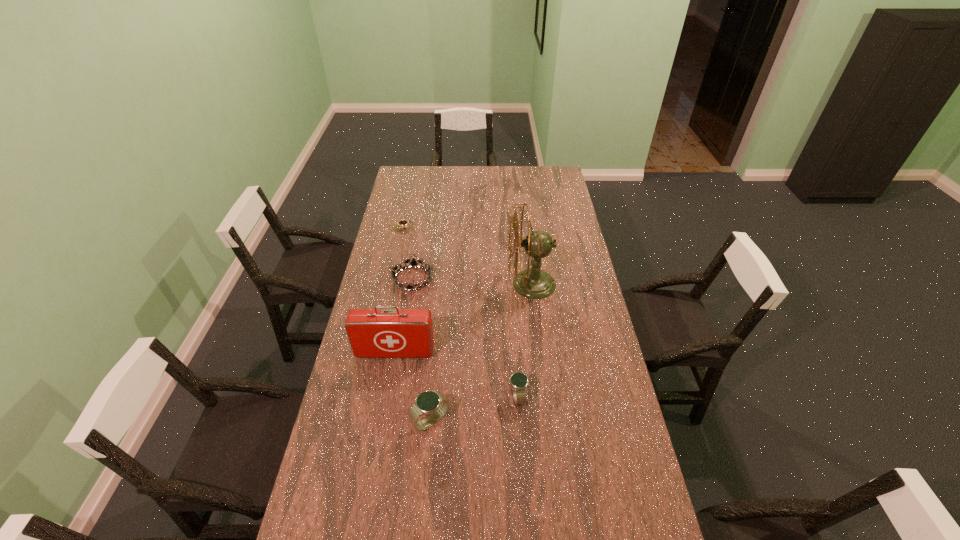
This screenshot has width=960, height=540. In order to click on vacant region located 0.150m on the back of the second watch from left to right in this screenshot , I will do `click(436, 368)`.

The image size is (960, 540). Identify the location of free spot located 0.340m on the back of the rightmost watch. tap(512, 309).

Identify the location of blank space located 0.200m on the front of the farthest watch. This screenshot has width=960, height=540. (397, 258).

The height and width of the screenshot is (540, 960). Find the location of `vacant space located on the side of the third nearest object with the first aid cross symbol`. vacant space located on the side of the third nearest object with the first aid cross symbol is located at coordinates (391, 376).

Image resolution: width=960 pixels, height=540 pixels. I want to click on free spot located 0.380m in front of the fan, directing air flow, so click(417, 284).

Find the location of a particular element. The height and width of the screenshot is (540, 960). vacant point located 0.380m in front of the fan, directing air flow is located at coordinates (417, 284).

Locate an element on the screen. The image size is (960, 540). free space located in front of the fan, directing air flow is located at coordinates (495, 284).

The width and height of the screenshot is (960, 540). What are the coordinates of `free location located 0.320m on the front-facing side of the fifth tallest object` in the screenshot? It's located at (510, 279).

Identify the location of watch that is at the left edge. (402, 222).

Find the location of a particular element. the first-aid kit that is positioned at the left edge is located at coordinates (373, 333).